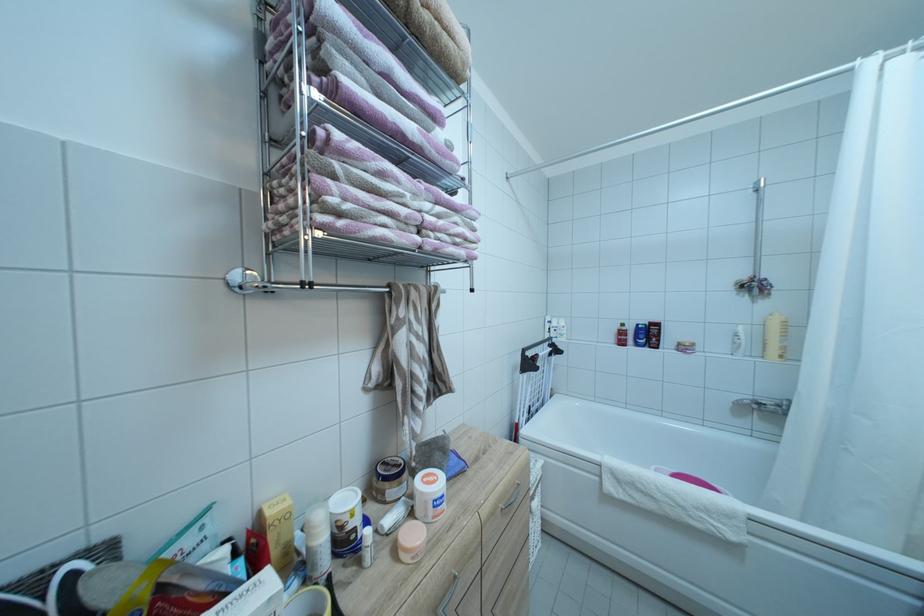
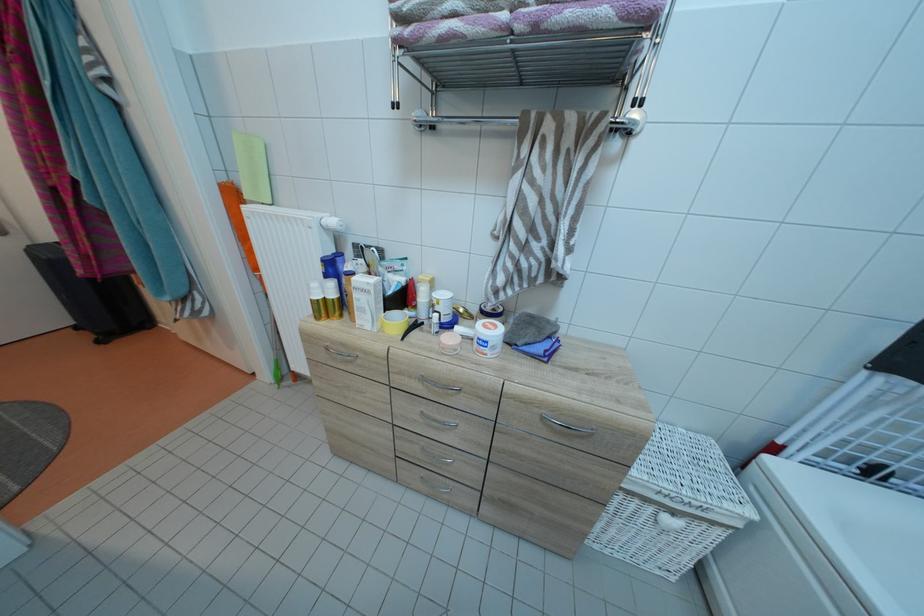
Find the pixel in the second image that matches pixel 442 487 in the first image.

(496, 334)